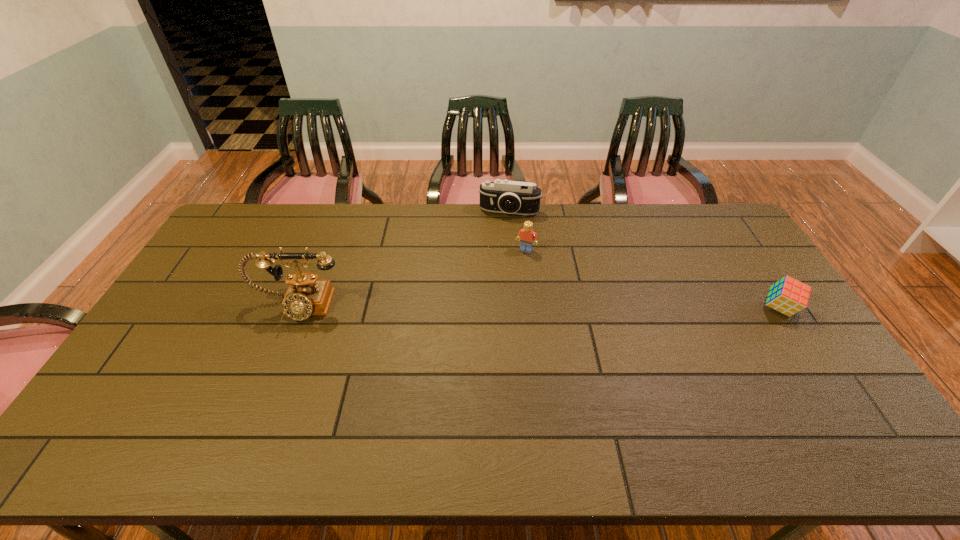
Find the location of `vacant space on the desktop that is between the leftmost object and the shortest object and is positioned on the front-facing side of the second farthest object`. vacant space on the desktop that is between the leftmost object and the shortest object and is positioned on the front-facing side of the second farthest object is located at coordinates point(497,307).

Identify the location of vacant space on the desktop that is between the leftmost object and the cube and is positioned on the front lens of the farthest object. (491, 307).